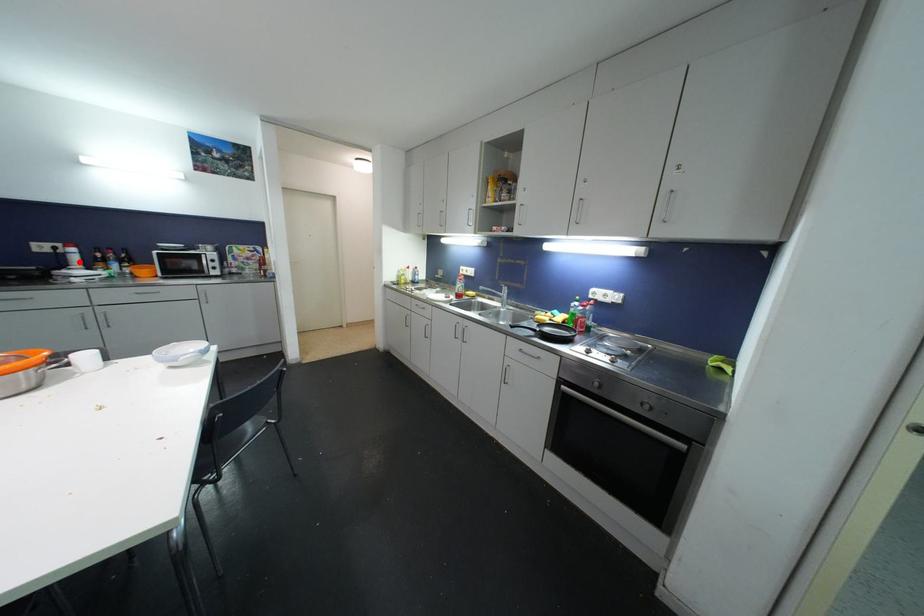
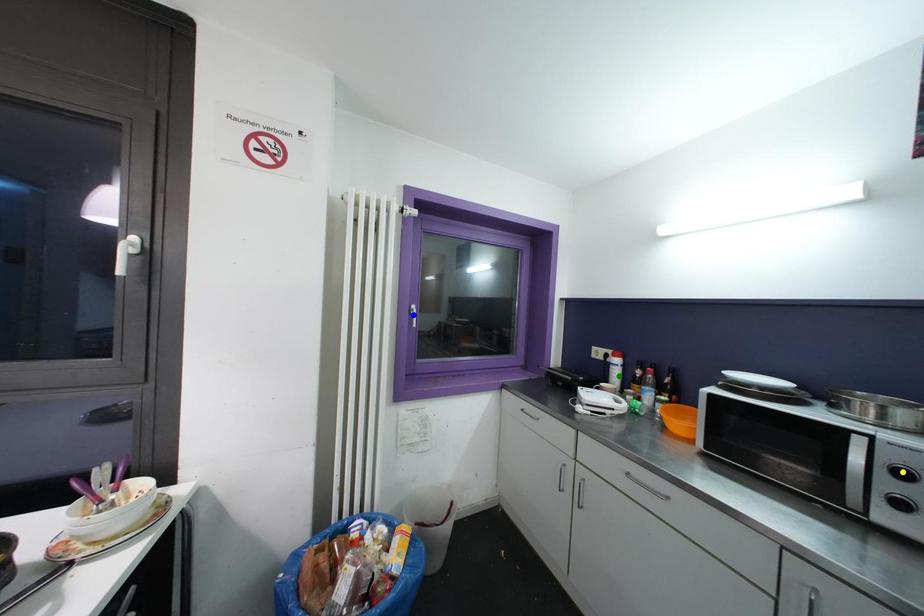
Question: I am providing you with two images of the same scene from different viewpoints. A red point is marked on the first image. You are given multiple points on the second image. Which point in image 2 is actually the same real-world point as the red point in image 1?

Choices:
 (A) green point
 (B) blue point
 (C) yellow point

Answer: (A)